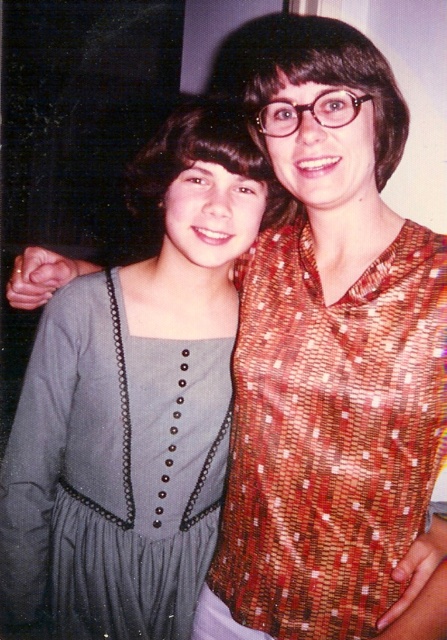
Looking at this image, is shiny brown blouse at center in front of gray textured fabric dress at center?

Yes, it is in front of gray textured fabric dress at center.

Is shiny brown blouse at center above gray textured fabric dress at center?

Correct, shiny brown blouse at center is located above gray textured fabric dress at center.

The image size is (447, 640). What do you see at coordinates (330, 435) in the screenshot?
I see `shiny brown blouse at center` at bounding box center [330, 435].

At what (x,y) coordinates should I click in order to perform the action: click on shiny brown blouse at center. Please return your answer as a coordinate pair (x, y). Image resolution: width=447 pixels, height=640 pixels. Looking at the image, I should click on (330, 435).